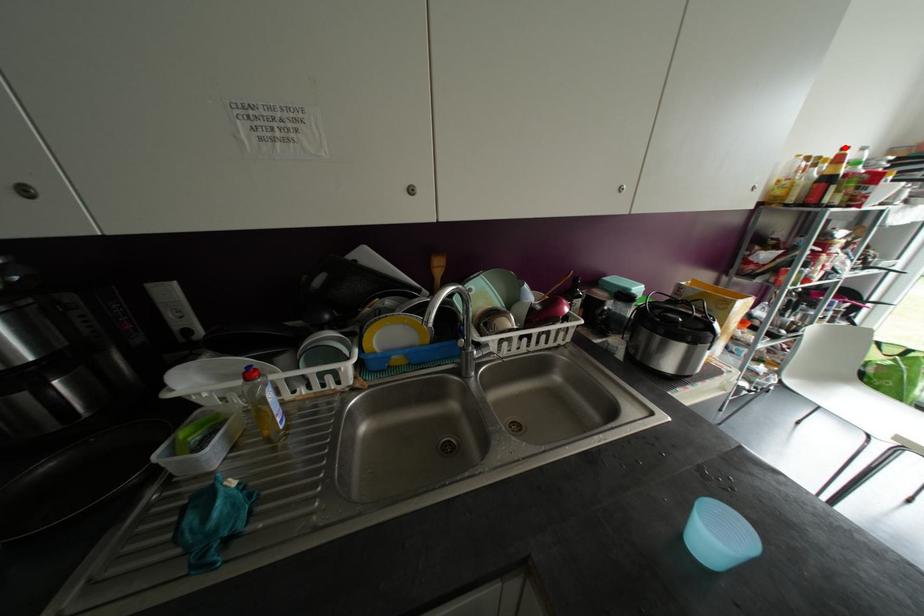
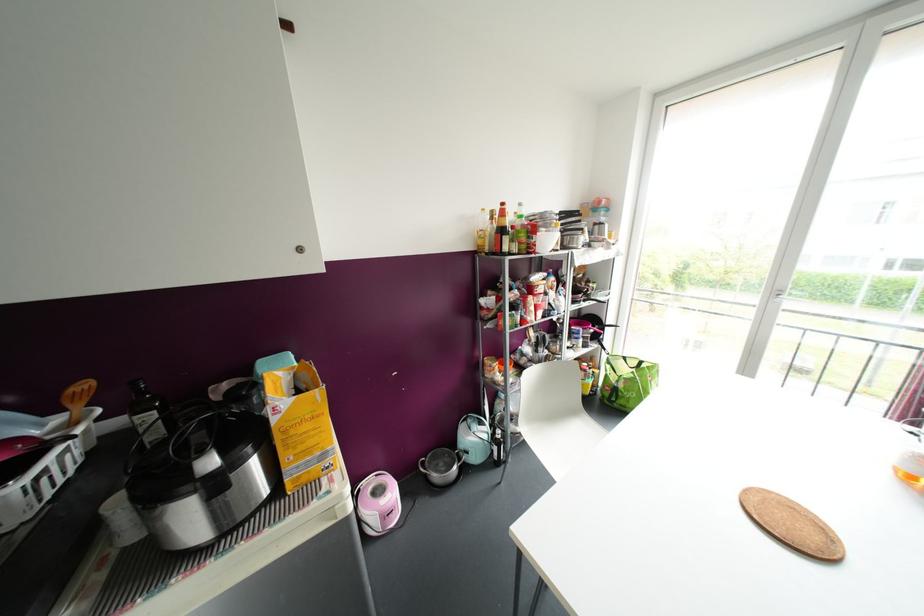
Question: I am providing you with two images of the same scene from different viewpoints. Image1 has a red point marked. In image2, the corresponding 3D location appears at what relative position? Reply with the corresponding letter.

Choices:
 (A) Closer
 (B) Farther

Answer: (A)